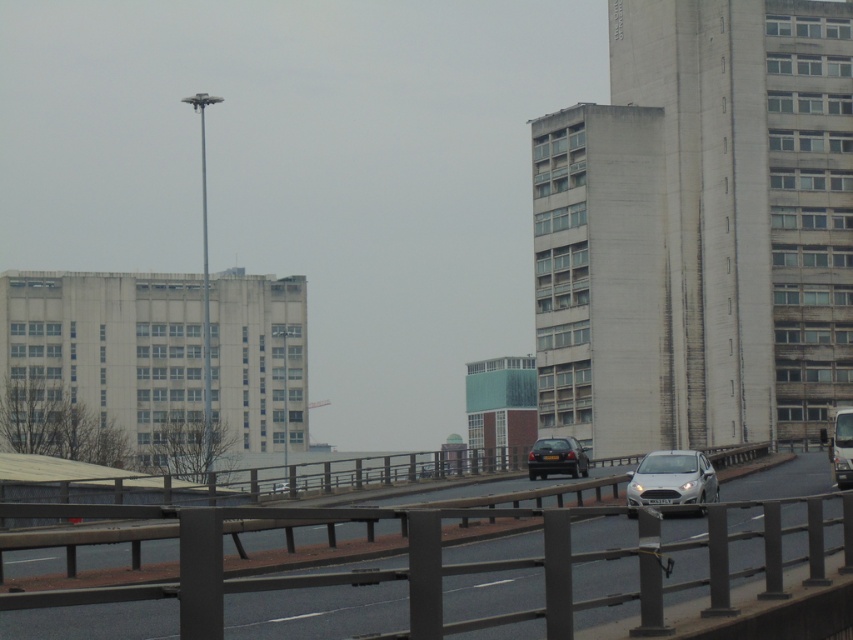
Does metallic gray highway at center appear on the right side of silver metallic car at center?

No, metallic gray highway at center is not to the right of silver metallic car at center.

Who is lower down, metallic gray highway at center or silver metallic car at center?

metallic gray highway at center is lower down.

Is point (347, 611) closer to viewer compared to point (648, 472)?

Yes, it is.

Find the location of `metallic gray highway at center`. metallic gray highway at center is located at coordinates (317, 612).

Is silver metallic car at center to the left of black glossy car at center from the viewer's perspective?

No, silver metallic car at center is not to the left of black glossy car at center.

Does silver metallic car at center have a lesser width compared to black glossy car at center?

Yes.

Is point (689, 464) closer to camera compared to point (573, 436)?

That is True.

Identify the location of silver metallic car at center. The image size is (853, 640). (672, 480).

Does metallic gray highway at center appear on the left side of black glossy car at center?

Correct, you'll find metallic gray highway at center to the left of black glossy car at center.

Who is positioned more to the right, metallic gray highway at center or black glossy car at center?

black glossy car at center is more to the right.

Who is more distant from viewer, (265, 564) or (548, 451)?

The point (548, 451) is more distant.

Image resolution: width=853 pixels, height=640 pixels. I want to click on metallic gray highway at center, so click(317, 612).